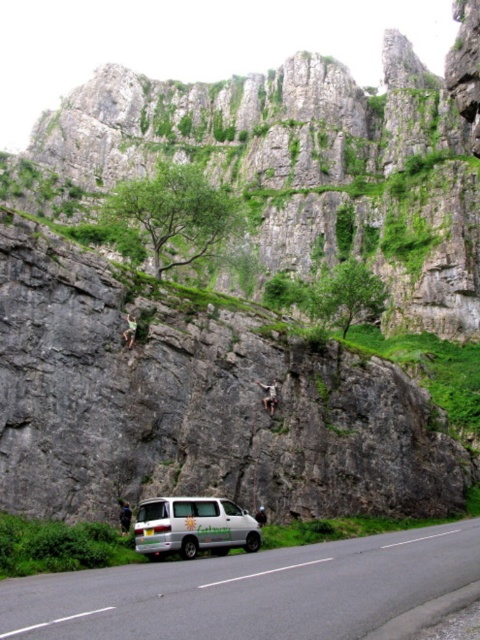
You are a hiker trying to park your car on the white asphalt road at lower center. However, there is a white matte van at lower center already parked there. Based on the scene, can you determine if there is enough space to park your car next to the van?

The white asphalt road at lower center is positioned over the white matte van at lower center, which means the van is parked on the road. Since the road is paved and the van is only partially obscuring it, there might be enough space to park next to the van, but this depends on the exact dimensions of the road and the van. However, based on the description provided, the road is at the lower center and the van is also at the lower center, so they are in the same area. Therefore, it is unclear if there is a 1

You are a hiker standing at the base of the cliff and want to reach the white asphalt road at lower center. Based on the coordinates provided in the scene description, in which direction should you walk to reach it?

The white asphalt road at lower center is located at coordinates point (250, 589). Since the road is at lower center, you should walk towards the bottom center direction to reach it.

You are standing at the edge of the cliff looking down at the white asphalt road at lower center. If you were to jump straight down, would you land on the road?

The white asphalt road at lower center is 21.21 meters away from you. Since the cliff is large and rugged, it is likely that the vertical drop to the road is significant. However, the given distance is a straight line, not vertical. Without knowing the angle of the cliff, we cannot determine if jumping straight down would land you on the road. The question cannot be answered definitively with the provided information.